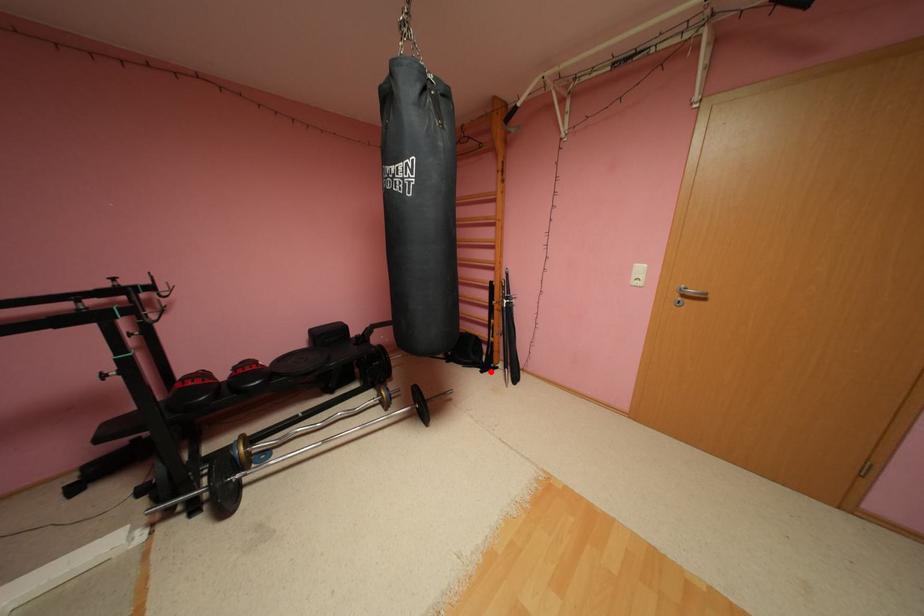
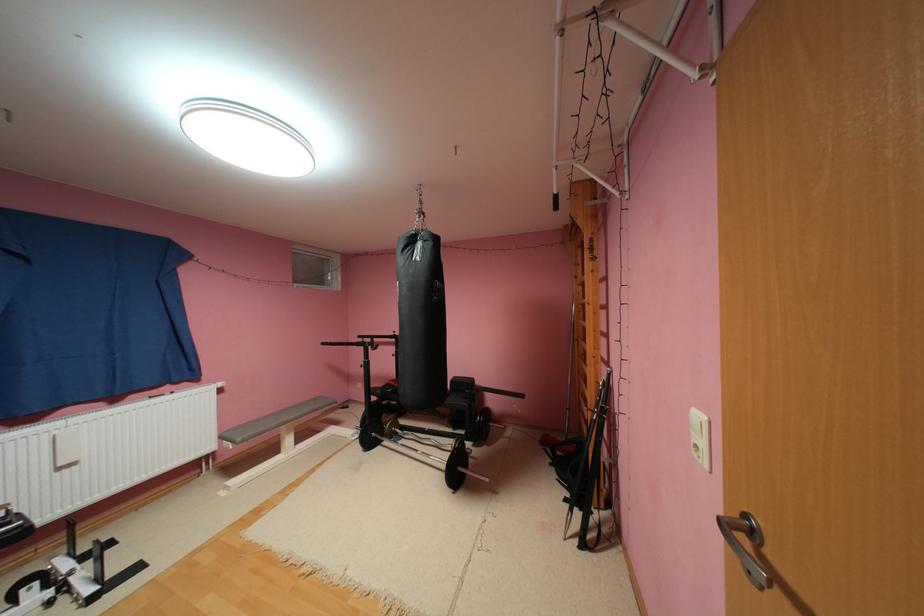
In the second image, find the point that corresponds to the highlighted location in the first image.

(575, 500)